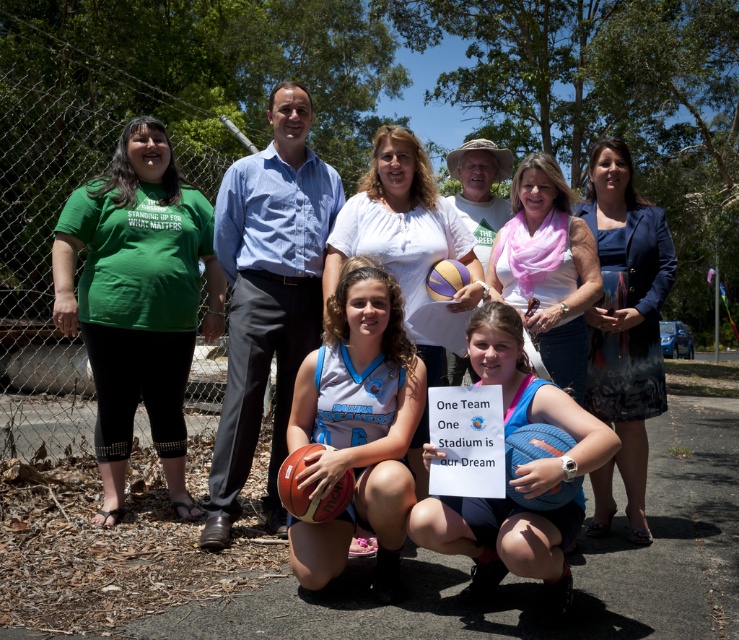
Does green matte shirt at left have a smaller size compared to blue textured dress at center?

No.

Can you confirm if green matte shirt at left is taller than blue textured dress at center?

No, green matte shirt at left is not taller than blue textured dress at center.

Between point (120, 392) and point (619, 186), which one is positioned behind?

Positioned behind is point (619, 186).

At what (x,y) coordinates should I click in order to perform the action: click on green matte shirt at left. Please return your answer as a coordinate pair (x, y). Looking at the image, I should click on (137, 300).

Is green matte shirt at left smaller than rubber textured basketball at lower center?

No, green matte shirt at left is not smaller than rubber textured basketball at lower center.

Is green matte shirt at left positioned in front of rubber textured basketball at lower center?

No.

Does point (129, 340) come in front of point (307, 492)?

No, it is not.

The image size is (739, 640). Find the location of `green matte shirt at left`. green matte shirt at left is located at coordinates (137, 300).

Who is more forward, (x=163, y=308) or (x=483, y=339)?

Point (x=483, y=339) is in front.

Who is more distant from viewer, (x=205, y=228) or (x=412, y=513)?

Point (x=205, y=228)

Find the location of a particular element. Image resolution: width=739 pixels, height=640 pixels. green matte shirt at left is located at coordinates (137, 300).